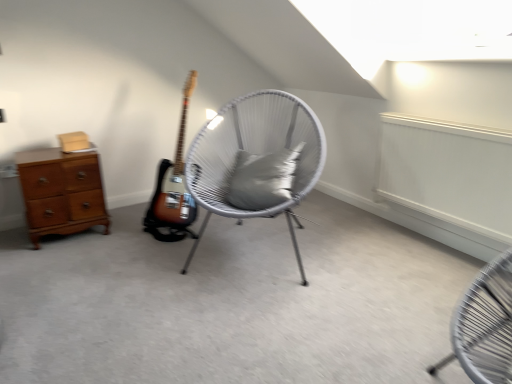
Locate an element on the screen. vacant position to the left of white woven chair at center is located at coordinates (119, 264).